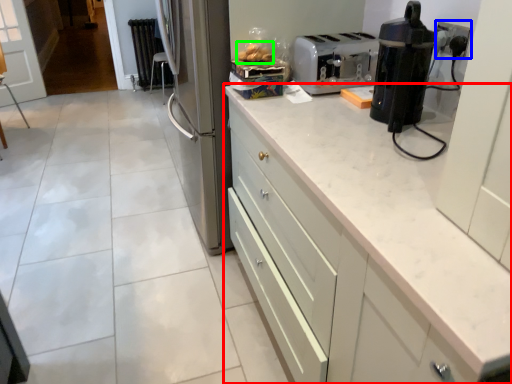
Question: Considering the real-world distances, which object is closest to cabinetry (highlighted by a red box)? electric outlet (highlighted by a blue box) or food (highlighted by a green box).

Choices:
 (A) electric outlet
 (B) food

Answer: (A)